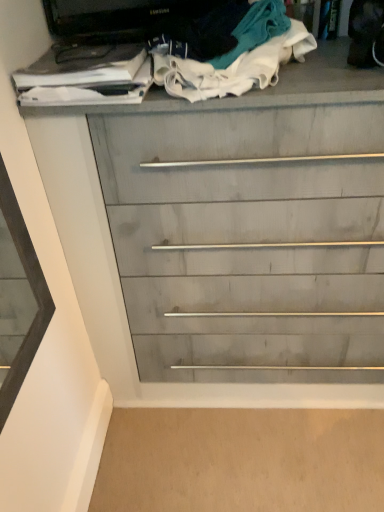
Question: Is white cotton socks at upper center, which is counted as the 2th clothing, starting from the right, not near gray wood chest of drawers at center?

Choices:
 (A) yes
 (B) no

Answer: (B)

Question: Would you say white cotton socks at upper center, which is counted as the 2th clothing, starting from the right, contains gray wood chest of drawers at center?

Choices:
 (A) yes
 (B) no

Answer: (B)

Question: Is white cotton socks at upper center, which is counted as the 2th clothing, starting from the right, shorter than gray wood chest of drawers at center?

Choices:
 (A) yes
 (B) no

Answer: (A)

Question: Is white cotton socks at upper center, which is counted as the 2th clothing, starting from the right, placed right next to gray wood chest of drawers at center?

Choices:
 (A) no
 (B) yes

Answer: (A)

Question: Does white cotton socks at upper center, which is counted as the 2th clothing, starting from the right, lie in front of gray wood chest of drawers at center?

Choices:
 (A) no
 (B) yes

Answer: (A)

Question: Considering the relative positions of white cotton socks at upper center, which ranks as the first clothing in left-to-right order, and gray wood chest of drawers at center in the image provided, is white cotton socks at upper center, which ranks as the first clothing in left-to-right order, behind gray wood chest of drawers at center?

Choices:
 (A) yes
 (B) no

Answer: (A)

Question: Is gray wood chest of drawers at center in front of white cotton socks at upper center, which is counted as the 2th clothing, starting from the right?

Choices:
 (A) yes
 (B) no

Answer: (A)

Question: Is gray wood chest of drawers at center shorter than white cotton socks at upper center, which ranks as the first clothing in left-to-right order?

Choices:
 (A) no
 (B) yes

Answer: (A)

Question: Is gray wood chest of drawers at center further to the viewer compared to white cotton socks at upper center, which is counted as the 2th clothing, starting from the right?

Choices:
 (A) no
 (B) yes

Answer: (A)

Question: Is gray wood chest of drawers at center smaller than white cotton socks at upper center, which ranks as the first clothing in left-to-right order?

Choices:
 (A) yes
 (B) no

Answer: (B)

Question: Can you confirm if gray wood chest of drawers at center is positioned to the right of white cotton socks at upper center, which ranks as the first clothing in left-to-right order?

Choices:
 (A) yes
 (B) no

Answer: (A)

Question: Considering the relative sizes of gray wood chest of drawers at center and white cotton socks at upper center, which is counted as the 2th clothing, starting from the right, in the image provided, is gray wood chest of drawers at center bigger than white cotton socks at upper center, which is counted as the 2th clothing, starting from the right,?

Choices:
 (A) yes
 (B) no

Answer: (A)

Question: Is gray wood chest of drawers at center positioned far away from white cotton cloth at upper center, the first clothing in the right-to-left sequence?

Choices:
 (A) yes
 (B) no

Answer: (B)